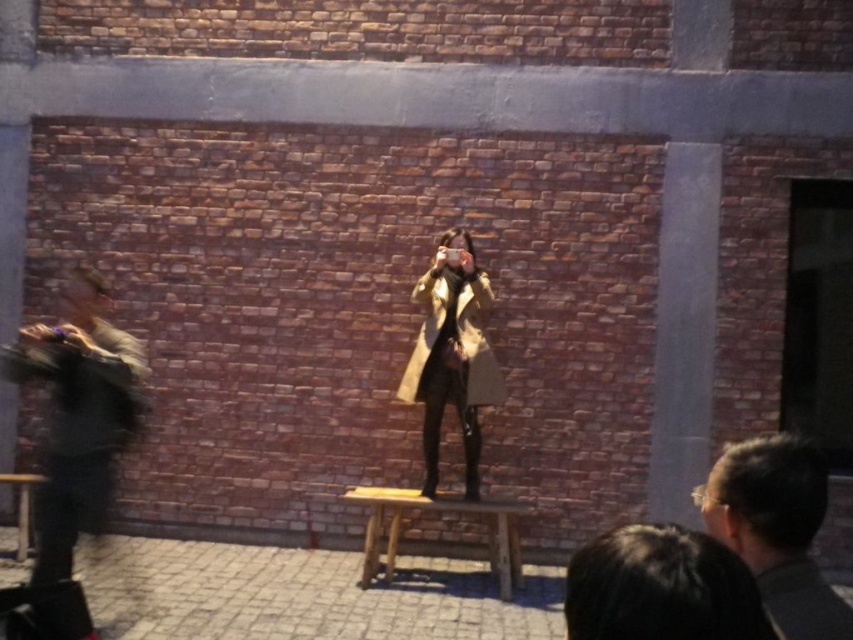
You are a photographer trying to capture the scene of a person taking a photo. You notice the dark gray fur coat at left and the dark brown hair at center. Which object is located lower in the image?

The dark gray fur coat at left is positioned under the dark brown hair at center, so it is located lower in the image.

You are a fashion photographer and need to position a model wearing the dark gray fur coat at left in the center of the frame. Given its current position at point 0.650 on the x axis and 0.094 on the y axis, what direction should the model move to reach the center of the frame?

The dark gray fur coat at left is currently at position 0.650 on the x axis and 0.094 on the y axis. To reach the center of the frame, the model should move left along the x axis and down along the y axis since the center is at position 0.5 on both axes.

You are a photographer trying to capture the person in the scene. Can you see the dark brown hair at center through the dark gray fur coat at left?

The dark brown hair at center is behind the dark gray fur coat at left, so it cannot be seen through the coat.